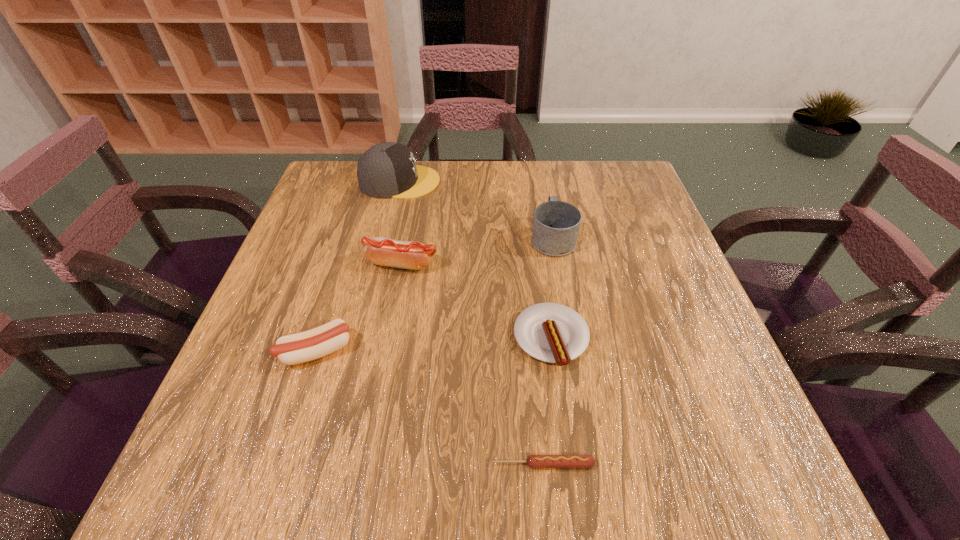
Image resolution: width=960 pixels, height=540 pixels. I want to click on the second closest object to the second shortest object, so click(x=533, y=461).

This screenshot has width=960, height=540. Identify the location of the third closest sausage relative to the farthest sausage. point(533,461).

I want to click on the second closest sausage relative to the fourth tallest object, so click(x=533, y=461).

The width and height of the screenshot is (960, 540). In order to click on vacant space that satisfies the following two spatial constraints: 1. on the side of the mug with the handle; 2. on the front-facing side of the tallest object in this screenshot , I will do `click(542, 181)`.

Find the location of a particular element. The height and width of the screenshot is (540, 960). vacant space that satisfies the following two spatial constraints: 1. on the front-facing side of the second shortest sausage; 2. on the right side of the tallest object is located at coordinates 364,338.

Image resolution: width=960 pixels, height=540 pixels. In order to click on blank space that satisfies the following two spatial constraints: 1. on the front-facing side of the farthest object; 2. on the front side of the third shortest object in this screenshot , I will do pos(361,351).

Find the location of a particular element. free space that satisfies the following two spatial constraints: 1. on the front-facing side of the cap; 2. on the back side of the farthest sausage is located at coordinates (381, 264).

Find the location of `free space that satisfies the following two spatial constraints: 1. on the back side of the farthest sausage; 2. on the front-facing side of the cap`. free space that satisfies the following two spatial constraints: 1. on the back side of the farthest sausage; 2. on the front-facing side of the cap is located at coordinates (417, 181).

Locate an element on the screen. The height and width of the screenshot is (540, 960). vacant region that satisfies the following two spatial constraints: 1. on the front side of the third tallest object; 2. on the left side of the nearest object is located at coordinates (365, 464).

This screenshot has height=540, width=960. I want to click on free spot that satisfies the following two spatial constraints: 1. on the front-facing side of the shortest object; 2. on the right side of the tallest object, so click(x=335, y=464).